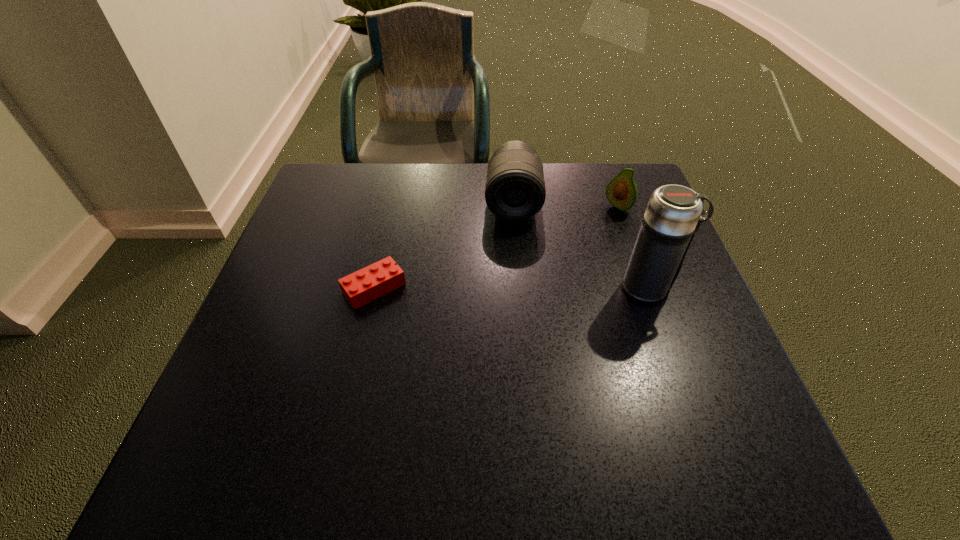
This screenshot has height=540, width=960. Identify the location of the shortest object. (365, 285).

The image size is (960, 540). In order to click on the leftmost object in this screenshot , I will do `click(365, 285)`.

At what (x,y) coordinates should I click in order to perform the action: click on thermos bottle. Please return your answer as a coordinate pair (x, y). Image resolution: width=960 pixels, height=540 pixels. Looking at the image, I should click on (673, 215).

In order to click on the second object from left to right in this screenshot , I will do `click(515, 190)`.

Identify the location of telephoto lens. (515, 190).

Where is `avocado`? avocado is located at coordinates (621, 192).

Find the location of a particular element. This screenshot has height=540, width=960. free space located 0.250m on the back of the shortest object is located at coordinates (394, 201).

Locate an element on the screen. This screenshot has height=540, width=960. free location located on the surface of the telephoto lens is located at coordinates (513, 306).

Identify the location of vacant space situated on the surface of the telephoto lens. The width and height of the screenshot is (960, 540). (514, 268).

The height and width of the screenshot is (540, 960). I want to click on vacant space situated on the surface of the telephoto lens, so (513, 306).